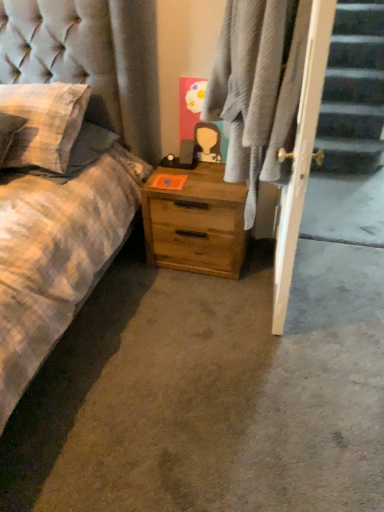
Question: Should I look upward or downward to see plaid fabric at center?

Choices:
 (A) up
 (B) down

Answer: (A)

Question: Is checkered fabric pillow at left in front of wooden nightstand at center?

Choices:
 (A) yes
 (B) no

Answer: (A)

Question: Can you confirm if checkered fabric pillow at left is smaller than wooden nightstand at center?

Choices:
 (A) no
 (B) yes

Answer: (B)

Question: Can you confirm if checkered fabric pillow at left is shorter than wooden nightstand at center?

Choices:
 (A) yes
 (B) no

Answer: (A)

Question: Is checkered fabric pillow at left taller than wooden nightstand at center?

Choices:
 (A) no
 (B) yes

Answer: (A)

Question: Is checkered fabric pillow at left positioned behind wooden nightstand at center?

Choices:
 (A) no
 (B) yes

Answer: (A)

Question: Considering the relative sizes of checkered fabric pillow at left and wooden nightstand at center in the image provided, is checkered fabric pillow at left thinner than wooden nightstand at center?

Choices:
 (A) yes
 (B) no

Answer: (B)

Question: From a real-world perspective, is plaid fabric at center positioned over wooden nightstand at center based on gravity?

Choices:
 (A) yes
 (B) no

Answer: (A)

Question: From a real-world perspective, is plaid fabric at center physically below wooden nightstand at center?

Choices:
 (A) yes
 (B) no

Answer: (B)

Question: Considering the relative sizes of plaid fabric at center and wooden nightstand at center in the image provided, is plaid fabric at center smaller than wooden nightstand at center?

Choices:
 (A) yes
 (B) no

Answer: (B)

Question: Is plaid fabric at center positioned far away from wooden nightstand at center?

Choices:
 (A) yes
 (B) no

Answer: (B)

Question: Does plaid fabric at center come in front of wooden nightstand at center?

Choices:
 (A) no
 (B) yes

Answer: (B)

Question: Is plaid fabric at center bigger than wooden nightstand at center?

Choices:
 (A) yes
 (B) no

Answer: (A)

Question: Considering the relative positions of checkered fabric pillow at left and plaid fabric at center in the image provided, is checkered fabric pillow at left to the right of plaid fabric at center from the viewer's perspective?

Choices:
 (A) no
 (B) yes

Answer: (A)